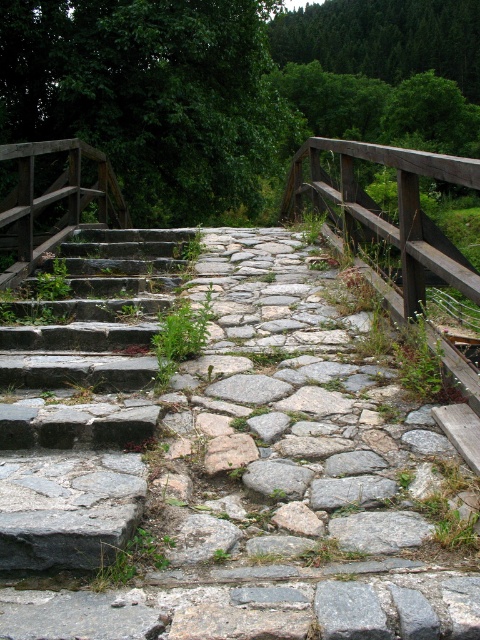
You are a hiker carrying a wide backpack and need to cross the rustic stone bridge. The gray stone path at center and the gray rough stone at center are both part of the bridge. Which part of the bridge can accommodate your wide backpack without needing to adjust your path?

The gray stone path at center can accommodate your wide backpack since its width is larger than the gray rough stone at center.

You are standing on the rustic stone bridge and want to go down to the lower level. There is a point marked at coordinate [84,401]. What is located at that point?

At point [84,401] lies rusty stone stairs at left.

You are a hiker carrying a heavy backpack and need to cross the rustic stone bridge. You notice the rusty stone stairs at left and the wooden rail at center. Which object would you prefer to use for support, and why?

You should use the wooden rail at center for support because it is larger in size compared to the rusty stone stairs at left, providing a more stable grip.